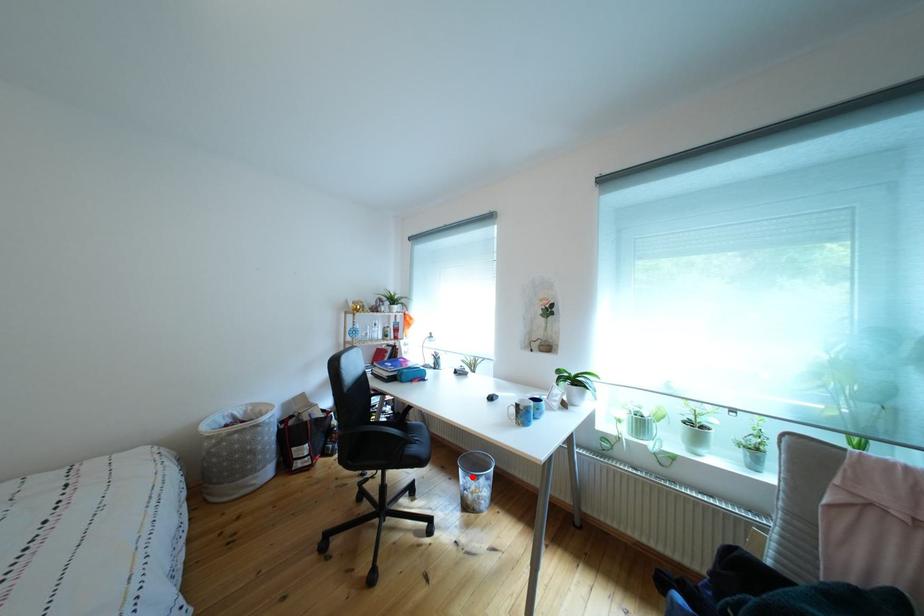
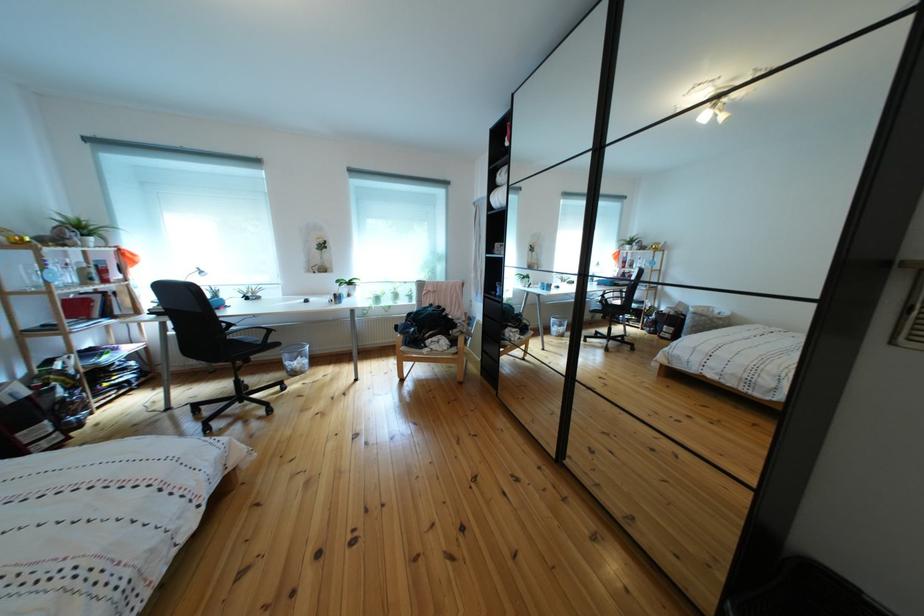
Question: I am providing you with two images of the same scene from different viewpoints. Image1 has a red point marked. In image2, the corresponding 3D location appears at what relative position? Reply with the corresponding letter.

Choices:
 (A) Closer
 (B) Farther

Answer: (A)